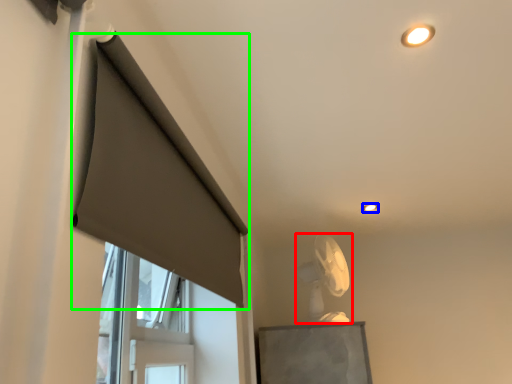
Question: Which object is positioned closest to fan (highlighted by a red box)? Select from lighting (highlighted by a blue box) and curtain (highlighted by a green box).

Choices:
 (A) lighting
 (B) curtain

Answer: (A)